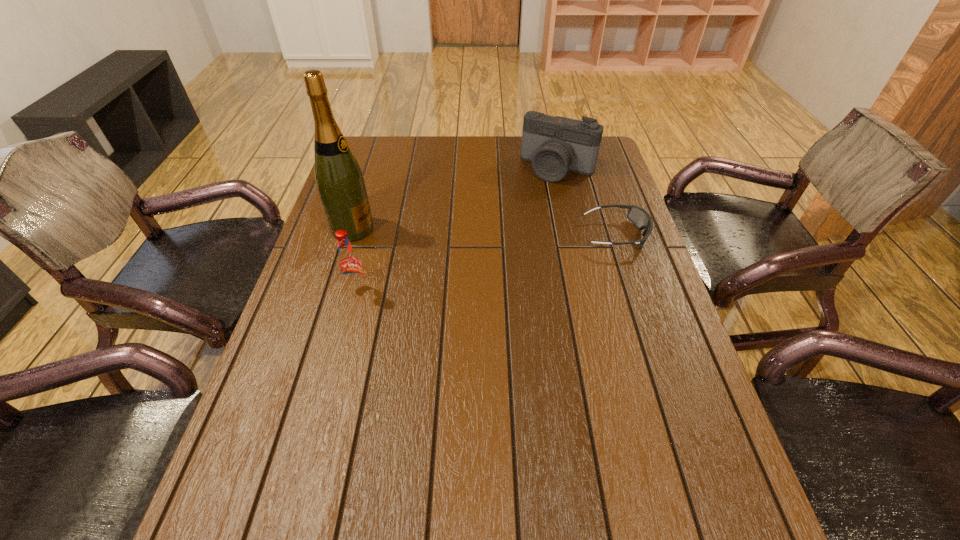
I want to click on root beer, so click(350, 267).

The image size is (960, 540). In order to click on the shortest object in this screenshot , I will do `click(638, 216)`.

Where is `the farthest object`? The height and width of the screenshot is (540, 960). the farthest object is located at coordinates (555, 145).

The width and height of the screenshot is (960, 540). I want to click on wine bottle, so pos(339,179).

Locate an element on the screen. This screenshot has width=960, height=540. free location located 0.280m on the right of the root beer is located at coordinates (480, 291).

Identify the location of vacant space situated 0.160m at the lens of the camera. This screenshot has height=540, width=960. (529, 212).

What are the coordinates of `vacant space located 0.390m at the lens of the camera` in the screenshot? It's located at (499, 261).

The width and height of the screenshot is (960, 540). I want to click on vacant space situated at the lens of the camera, so click(538, 198).

Find the location of a particular element. This screenshot has width=960, height=540. vacant space located 0.360m on the front-facing side of the wine bottle is located at coordinates (495, 253).

You are a GUI agent. You are given a task and a screenshot of the screen. Output one action in this format:
    pyautogui.click(x=<x>, y=<y>)
    Task: Click on the vacant region located on the front-facing side of the wine bottle
    This screenshot has width=960, height=540.
    Given the screenshot: What is the action you would take?
    pyautogui.click(x=432, y=242)